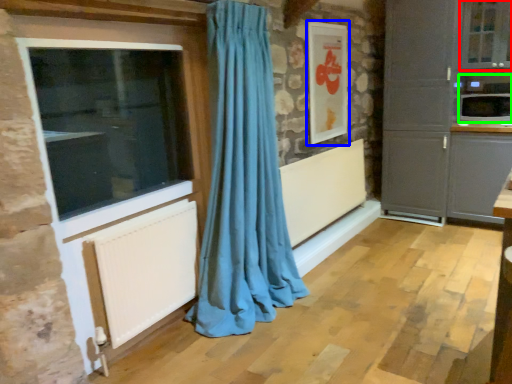
Question: Estimate the real-world distances between objects in this image. Which object is closer to window (highlighted by a red box), picture frame (highlighted by a blue box) or appliance (highlighted by a green box)?

Choices:
 (A) picture frame
 (B) appliance

Answer: (B)